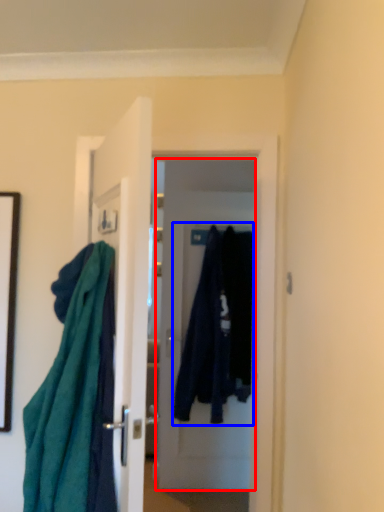
Question: Which object is closer to the camera taking this photo, door (highlighted by a red box) or clothing (highlighted by a blue box)?

Choices:
 (A) door
 (B) clothing

Answer: (B)